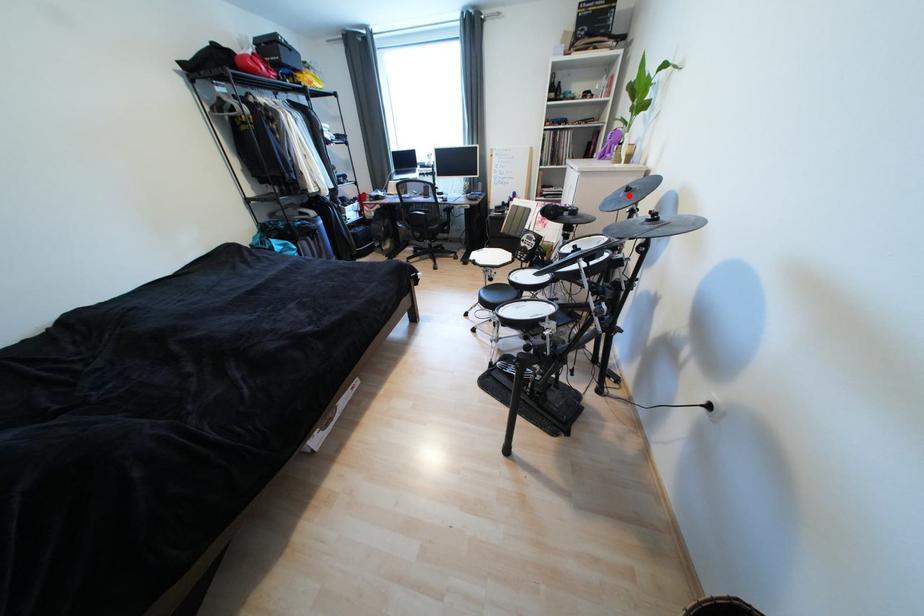
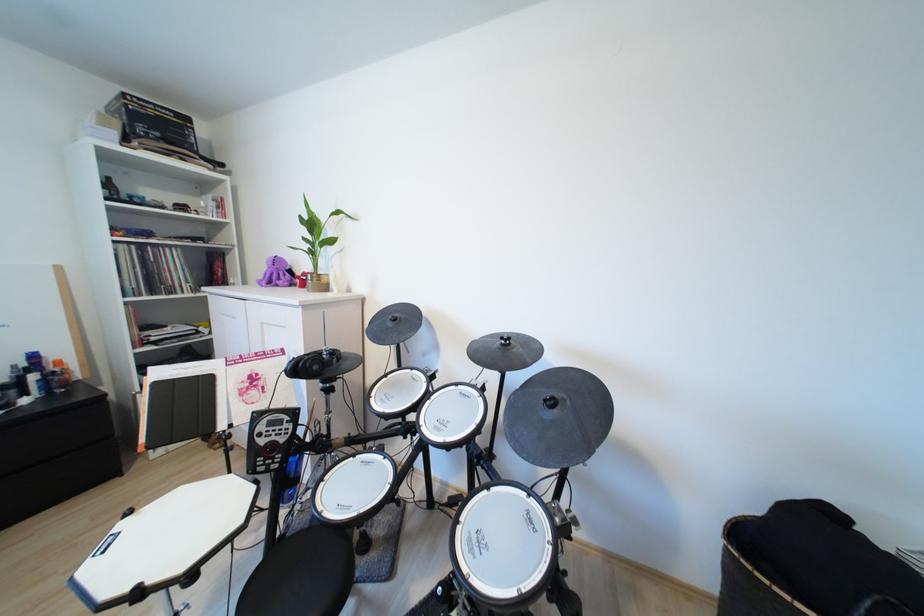
In the second image, find the point that corresponds to the highlighted location in the first image.

(396, 325)